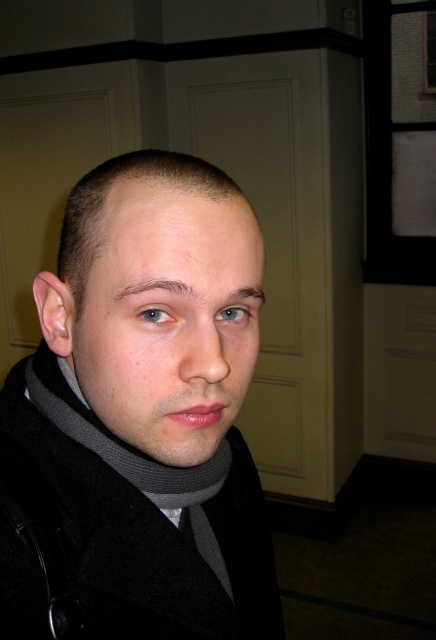
Is black woolen coat at center to the left of gray wool scarf at center from the viewer's perspective?

No, black woolen coat at center is not to the left of gray wool scarf at center.

Does black woolen coat at center have a lesser height compared to gray wool scarf at center?

No.

The height and width of the screenshot is (640, 436). In order to click on black woolen coat at center in this screenshot , I will do `click(122, 529)`.

Measure the distance between point (123, 348) and camera.

Point (123, 348) and camera are 36.80 centimeters apart.

Does point (197, 282) lie behind point (81, 436)?

No, it is in front of (81, 436).

Locate an element on the screen. The height and width of the screenshot is (640, 436). matte gray scarf at center is located at coordinates (169, 317).

Which of these two, black woolen coat at center or matte gray scarf at center, stands shorter?

matte gray scarf at center is shorter.

Describe the element at coordinates (122, 529) in the screenshot. This screenshot has width=436, height=640. I see `black woolen coat at center` at that location.

Identify the location of black woolen coat at center. (122, 529).